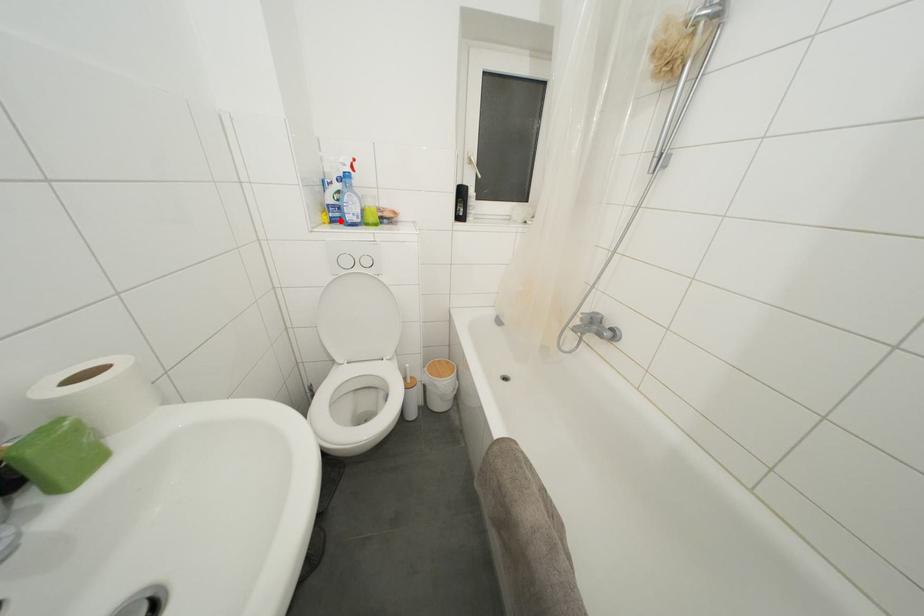
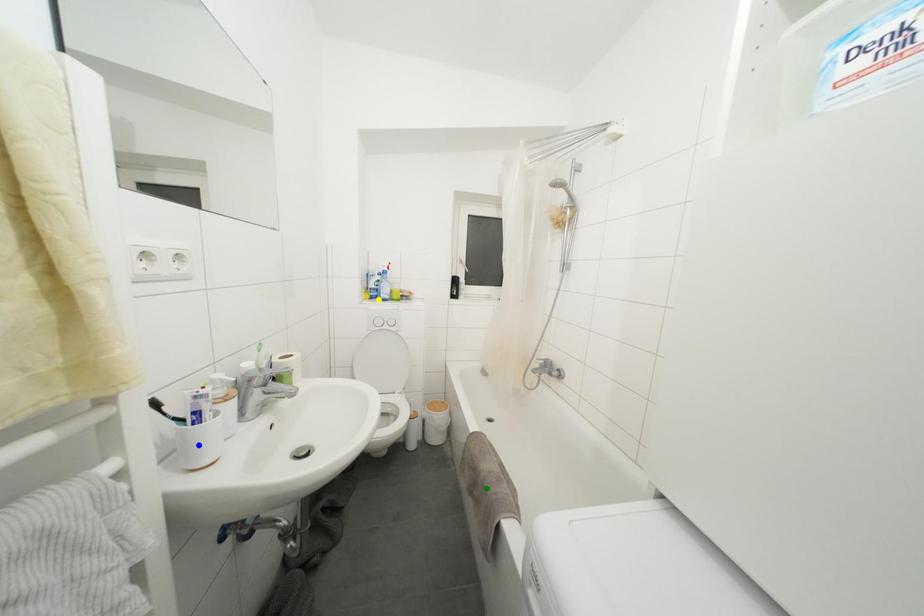
Question: I am providing you with two images of the same scene from different viewpoints. A red point is marked on the first image. You are given multiple points on the second image. In image 2, which mark is for the same physical point as the one in image 1?

Choices:
 (A) yellow point
 (B) blue point
 (C) green point

Answer: (A)